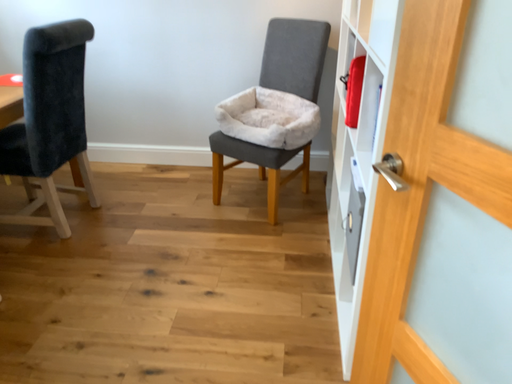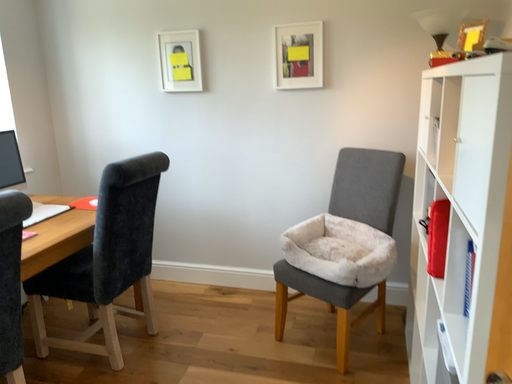
Question: How did the camera likely rotate when shooting the video?

Choices:
 (A) rotated downward
 (B) rotated upward

Answer: (B)